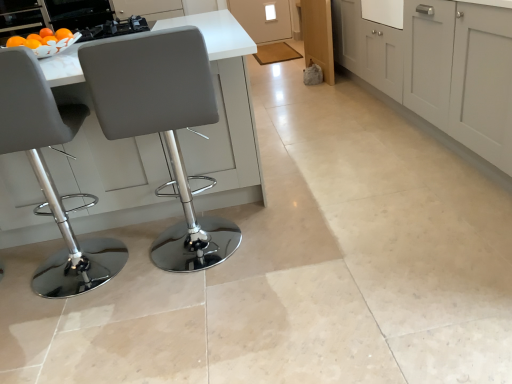
Question: Would you say matte gray cabinets at center, which is counted as the first cabinetry, starting from the front, is outside matte gray stool at left, arranged as the 1th chair when viewed from the left?

Choices:
 (A) yes
 (B) no

Answer: (A)

Question: Is matte gray stool at left, the second chair from the right, a part of matte gray cabinets at center, marked as the 2th cabinetry in a back-to-front arrangement?

Choices:
 (A) yes
 (B) no

Answer: (B)

Question: Are matte gray cabinets at center, marked as the 2th cabinetry in a back-to-front arrangement, and matte gray stool at left, arranged as the 1th chair when viewed from the left, located far from each other?

Choices:
 (A) no
 (B) yes

Answer: (B)

Question: Does matte gray cabinets at center, marked as the 2th cabinetry in a back-to-front arrangement, have a greater height compared to matte gray stool at left, the second chair from the right?

Choices:
 (A) no
 (B) yes

Answer: (A)

Question: Is matte gray cabinets at center, which is counted as the first cabinetry, starting from the front, looking in the opposite direction of matte gray stool at left, the second chair from the right?

Choices:
 (A) no
 (B) yes

Answer: (A)

Question: Is matte gray cabinets at center, which is counted as the first cabinetry, starting from the front, wider than matte gray stool at left, the second chair from the right?

Choices:
 (A) yes
 (B) no

Answer: (A)

Question: From the image's perspective, is matte gray chair at left, the second chair in the left-to-right sequence, located above matte gray stool at left, arranged as the 1th chair when viewed from the left?

Choices:
 (A) yes
 (B) no

Answer: (A)

Question: Is matte gray stool at left, the second chair from the right, inside matte gray chair at left, the second chair in the left-to-right sequence?

Choices:
 (A) yes
 (B) no

Answer: (B)

Question: Are matte gray chair at left, which is the first chair in right-to-left order, and matte gray stool at left, arranged as the 1th chair when viewed from the left, making contact?

Choices:
 (A) no
 (B) yes

Answer: (A)

Question: Considering the relative positions of matte gray chair at left, which is the first chair in right-to-left order, and matte gray stool at left, arranged as the 1th chair when viewed from the left, in the image provided, is matte gray chair at left, which is the first chair in right-to-left order, to the left of matte gray stool at left, arranged as the 1th chair when viewed from the left, from the viewer's perspective?

Choices:
 (A) yes
 (B) no

Answer: (B)

Question: From a real-world perspective, is matte gray chair at left, which is the first chair in right-to-left order, on matte gray stool at left, arranged as the 1th chair when viewed from the left?

Choices:
 (A) no
 (B) yes

Answer: (A)

Question: Is matte gray chair at left, which is the first chair in right-to-left order, oriented away from matte gray stool at left, the second chair from the right?

Choices:
 (A) yes
 (B) no

Answer: (B)

Question: Is matte gray stool at left, arranged as the 1th chair when viewed from the left, taller than metallic black stove at upper left?

Choices:
 (A) yes
 (B) no

Answer: (A)